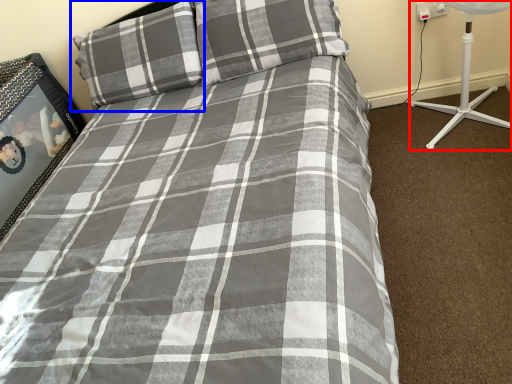
Question: Among these objects, which one is nearest to the camera, fan (highlighted by a red box) or pillow (highlighted by a blue box)?

Choices:
 (A) fan
 (B) pillow

Answer: (A)